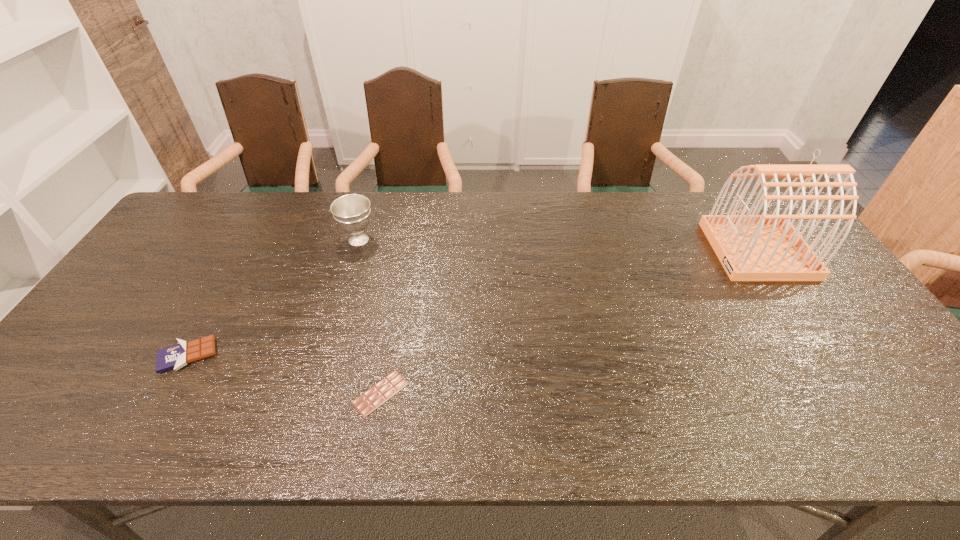
The image size is (960, 540). I want to click on free point between the leftmost object and the right chocolate bar, so (x=284, y=374).

Find the location of a particular element. free space that is in between the birdcage and the third shortest object is located at coordinates (558, 245).

Image resolution: width=960 pixels, height=540 pixels. Find the location of `vacant region between the rightmost object and the second shortest object`. vacant region between the rightmost object and the second shortest object is located at coordinates (472, 303).

Choose which object is the nearest neighbor to the shorter chocolate bar. Please provide its 2D coordinates. Your answer should be formatted as a tuple, i.e. [(x, y)], where the tuple contains the x and y coordinates of a point satisfying the conditions above.

[(176, 356)]

Identify which object is the third nearest to the third object from right to left. Please provide its 2D coordinates. Your answer should be formatted as a tuple, i.e. [(x, y)], where the tuple contains the x and y coordinates of a point satisfying the conditions above.

[(752, 247)]

Find the location of a particular element. This screenshot has height=540, width=960. vacant position in the image that satisfies the following two spatial constraints: 1. on the front side of the chalice; 2. on the right side of the right chocolate bar is located at coordinates (313, 393).

Where is `free spot that satisfies the following two spatial constraints: 1. with an open door on the birdcage; 2. on the front side of the shortest object`? free spot that satisfies the following two spatial constraints: 1. with an open door on the birdcage; 2. on the front side of the shortest object is located at coordinates (852, 393).